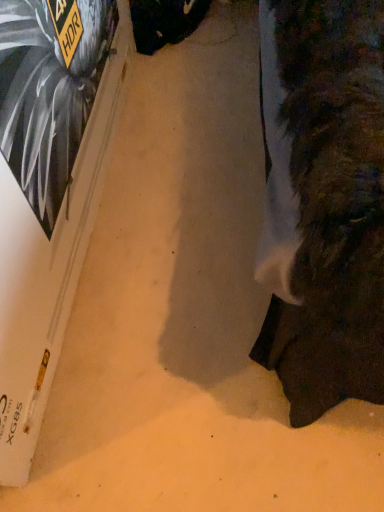
Question: Should I look upward or downward to see white cardboard box at upper left?

Choices:
 (A) up
 (B) down

Answer: (A)